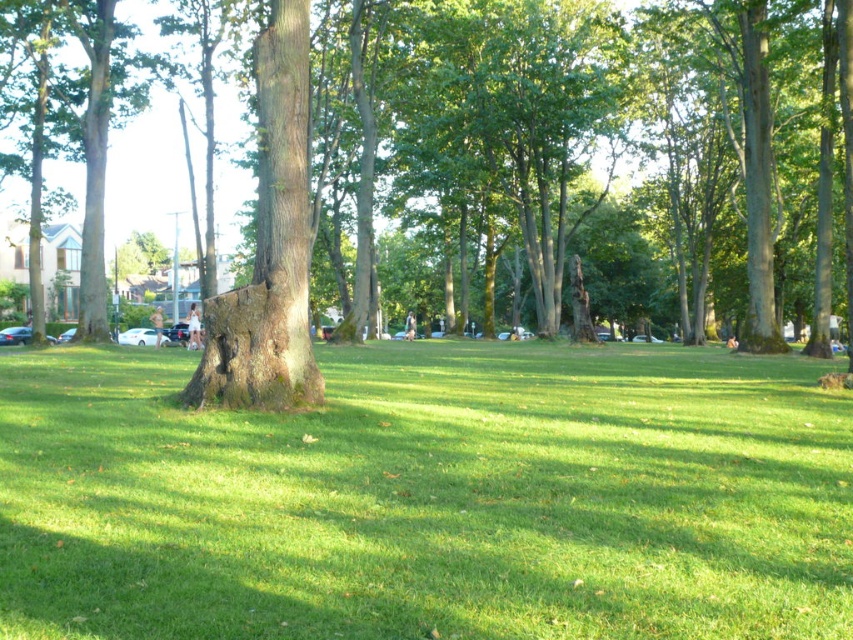
Question: Is rough bark tree at center positioned behind smooth brown tree trunk at center?

Choices:
 (A) yes
 (B) no

Answer: (A)

Question: Among these points, which one is farthest from the camera?

Choices:
 (A) (631, 83)
 (B) (201, 385)
 (C) (439, 536)

Answer: (A)

Question: Is green grassy at center wider than rough bark tree at center?

Choices:
 (A) no
 (B) yes

Answer: (A)

Question: Among these points, which one is farthest from the camera?

Choices:
 (A) (572, 545)
 (B) (206, 372)

Answer: (B)

Question: Which point is farther to the camera?

Choices:
 (A) tap(730, 483)
 (B) tap(306, 237)

Answer: (B)

Question: Considering the relative positions of rough bark tree at center and smooth brown tree trunk at center in the image provided, where is rough bark tree at center located with respect to smooth brown tree trunk at center?

Choices:
 (A) left
 (B) right

Answer: (B)